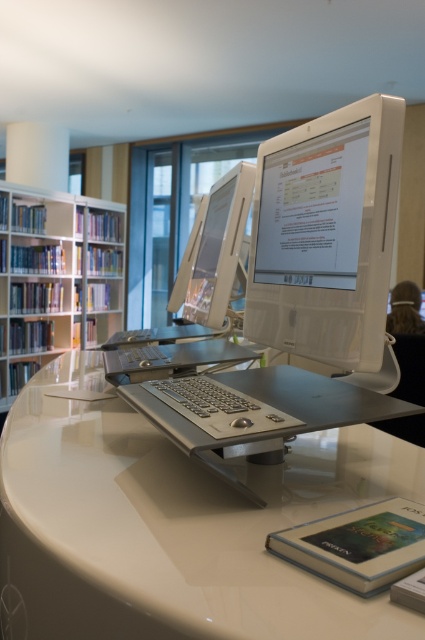
You are standing in the library and see two points marked in the image. The first point is at coordinate point (42, 483) and the second is at point (214, 221). Which point is closer to you?

Point (42, 483) is closer to the viewer than point (214, 221).

You are a library visitor who wants to use the computers. You are standing in front of the white glossy computer desk at center and the satin silver monitor at center. Which object is closer to you?

The white glossy computer desk at center is closer to the viewer than the satin silver monitor at center.

You are standing in a modern library with two Apple iMac desktop computers on a curved white desk. Each computer has a keyboard and mouse in front of its monitor. There is a point labeled as point (326, 234) in the scene. Based on the coordinates, which object is located at that point?

The point (326, 234) corresponds to the white glossy monitor at center.